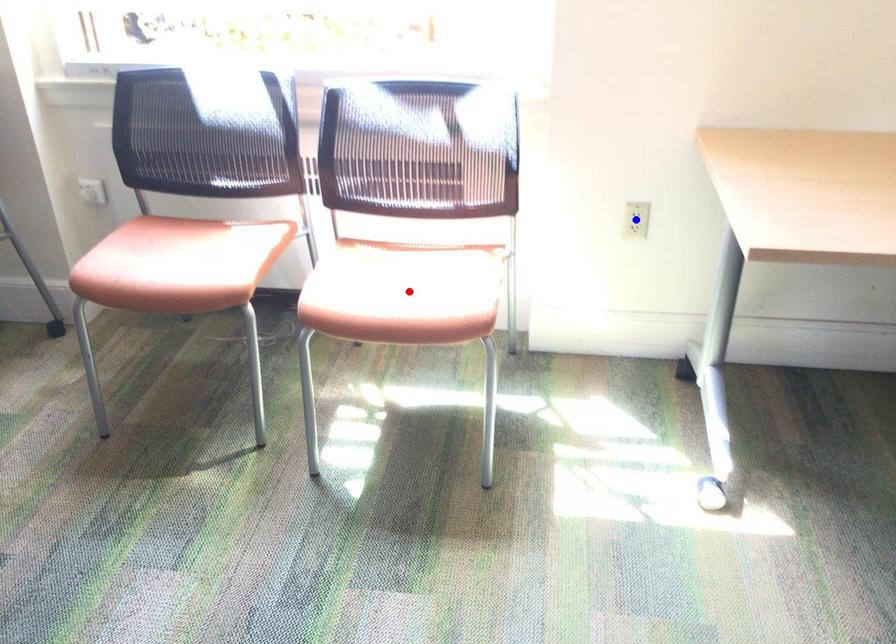
Question: Which of the two points in the image is closer to the camera?

Choices:
 (A) Blue point is closer.
 (B) Red point is closer.

Answer: (B)